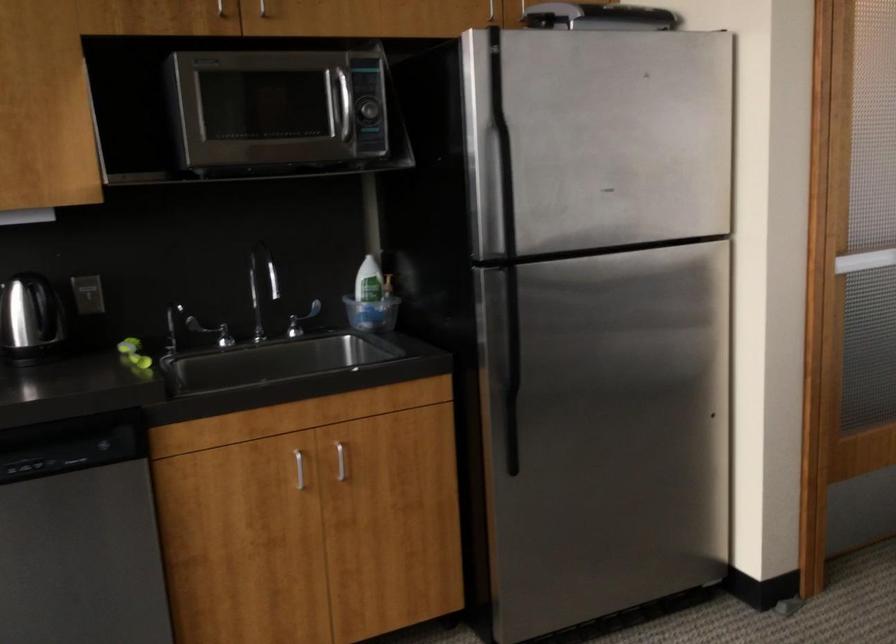
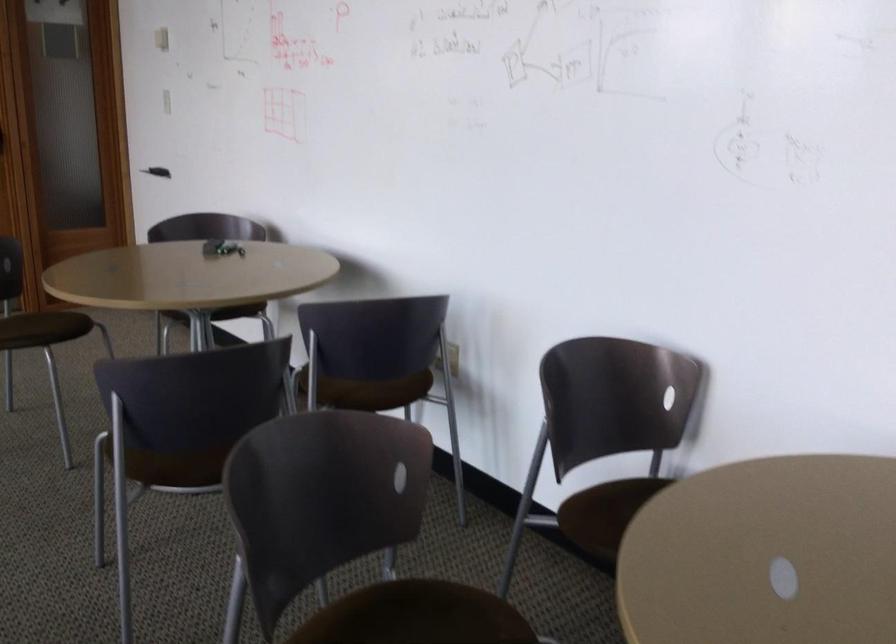
Which direction would the cameraman need to move to produce the second image?

The movement direction of the cameraman is right, backward.